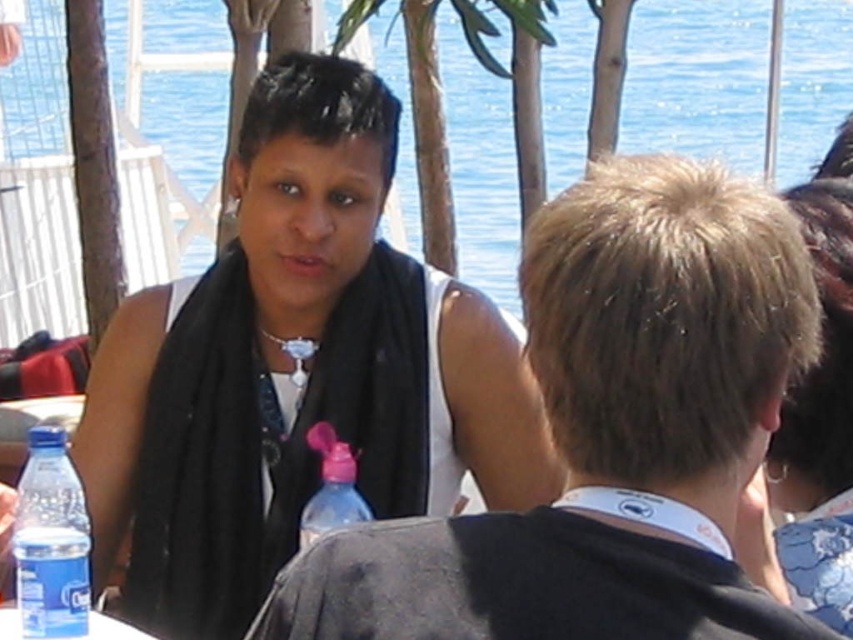
Question: Does matte black scarf at center appear under pink plastic bottle at center?

Choices:
 (A) yes
 (B) no

Answer: (B)

Question: Which object appears farthest from the camera in this image?

Choices:
 (A) smooth brown hair at center
 (B) transparent water at upper center

Answer: (B)

Question: Which point is closer to the camera?

Choices:
 (A) clear plastic bottle at lower left
 (B) blue plastic bottle at lower left
 (C) pink plastic bottle at center
 (D) matte black scarf at center

Answer: (A)

Question: Is pink plastic bottle at center thinner than clear plastic bottle at lower left?

Choices:
 (A) no
 (B) yes

Answer: (B)

Question: Can you confirm if matte black scarf at center is positioned above smooth brown hair at center?

Choices:
 (A) no
 (B) yes

Answer: (B)

Question: Among these points, which one is nearest to the camera?

Choices:
 (A) (802, 125)
 (B) (396, 474)

Answer: (B)